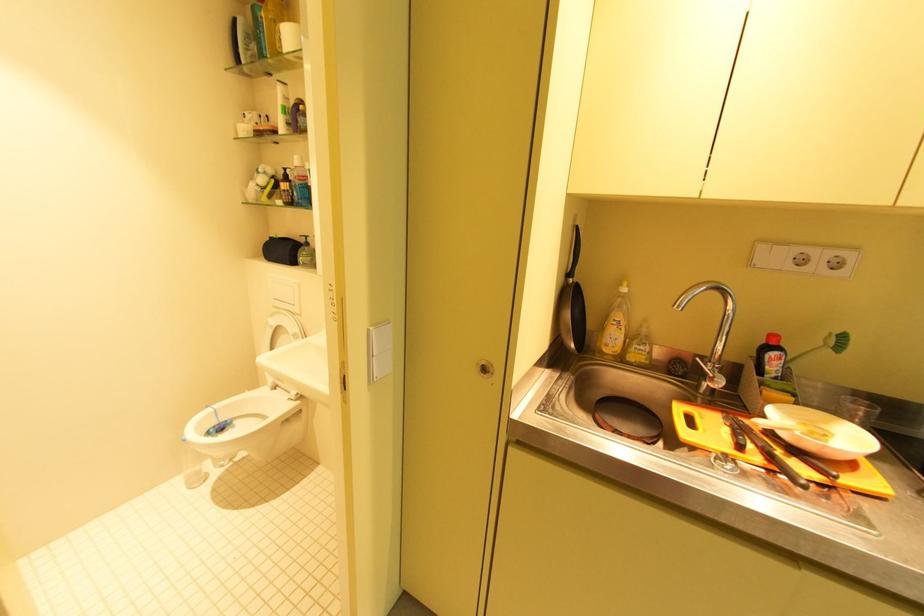
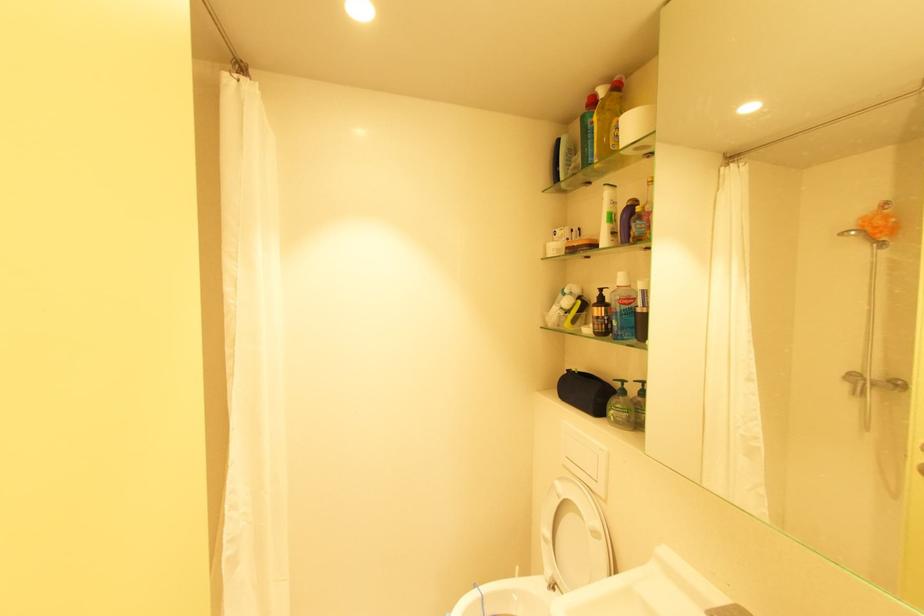
Locate, in the second image, the point that corresponds to [286,41] in the first image.

(623, 136)